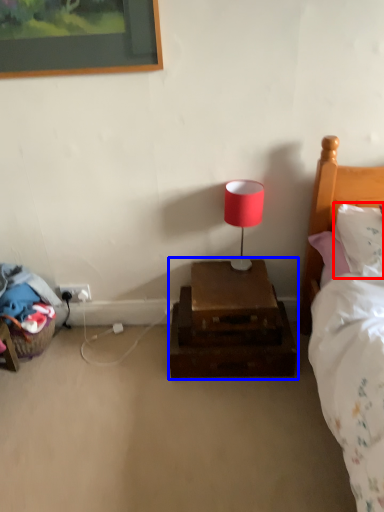
Question: Among these objects, which one is farthest to the camera, pillow (highlighted by a red box) or nightstand (highlighted by a blue box)?

Choices:
 (A) pillow
 (B) nightstand

Answer: (B)